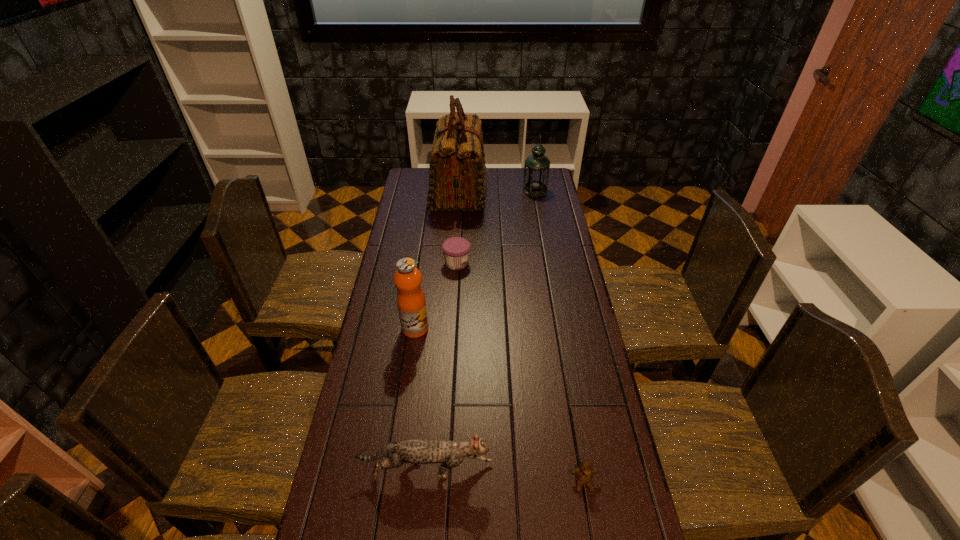
Locate an element on the screen. Image resolution: width=960 pixels, height=540 pixels. free space located on the front label of the jam is located at coordinates (568, 263).

Image resolution: width=960 pixels, height=540 pixels. In order to click on shopping bag that is at the far edge in this screenshot , I will do `click(457, 181)`.

Find the location of a particular element. This screenshot has width=960, height=540. oil lamp that is at the far edge is located at coordinates (536, 172).

I want to click on shopping bag that is at the left edge, so click(x=457, y=181).

This screenshot has width=960, height=540. I want to click on fruit juice located at the left edge, so click(x=411, y=302).

What are the coordinates of `cat present at the left edge` in the screenshot? It's located at (450, 454).

Locate an element on the screen. The image size is (960, 540). oil lamp positioned at the right edge is located at coordinates (536, 172).

Locate an element on the screen. The image size is (960, 540). teddy bear located in the right edge section of the desktop is located at coordinates (x=584, y=473).

You are a GUI agent. You are given a task and a screenshot of the screen. Output one action in this format:
    pyautogui.click(x=<x>, y=<y>)
    Task: Click on the object present at the far left corner
    
    Given the screenshot: What is the action you would take?
    pyautogui.click(x=457, y=181)

Locate an element on the screen. object that is at the far right corner is located at coordinates (536, 172).